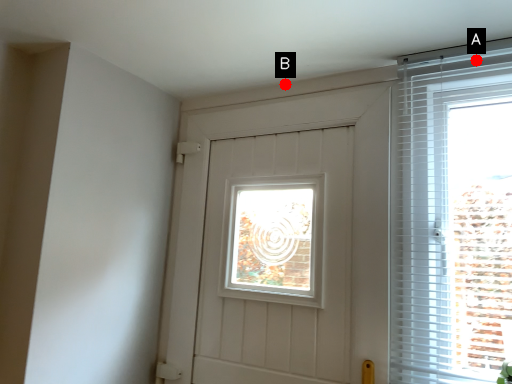
Question: Two points are circled on the image, labeled by A and B beside each circle. Which point is closer to the camera?

Choices:
 (A) A is closer
 (B) B is closer

Answer: (A)